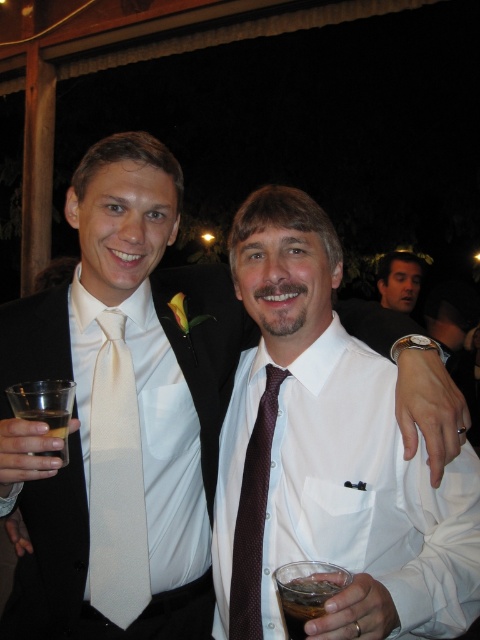
You are a photographer at a formal event and need to adjust the lighting to ensure both the white satin business suit at center and the white satin tie at center are visible. Since they are both white, how can you tell them apart in the image?

The white satin business suit at center is positioned over the white satin tie at center, so the suit will appear above the tie in the image, allowing you to distinguish them based on their vertical placement.

You are a photographer at a formal event. You need to place a decorative pin exactly at point (50, 556). According to the scene description, where should you place the pin?

The point (50, 556) is on the white satin business suit at center, so you should place the pin on the white satin business suit at center.